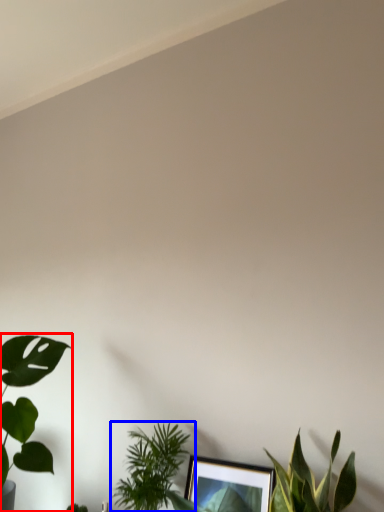
Question: Which object appears closest to the camera in this image, houseplant (highlighted by a red box) or houseplant (highlighted by a blue box)?

Choices:
 (A) houseplant
 (B) houseplant

Answer: (A)